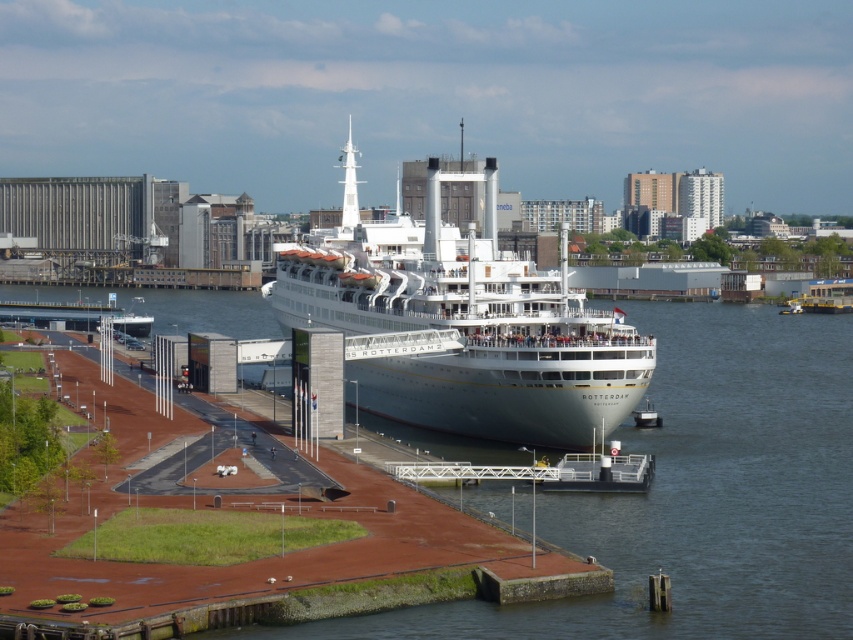
Who is taller, clear water at center or white glossy cruise ship at center?

white glossy cruise ship at center

This screenshot has width=853, height=640. In order to click on clear water at center in this screenshot , I will do `click(700, 496)`.

Is point (828, 337) positioned in front of point (556, 381)?

That is False.

In order to click on clear water at center in this screenshot , I will do `click(700, 496)`.

Looking at this image, who is higher up, white glossy cruise ship at center or white glossy boat at lower left?

white glossy cruise ship at center is higher up.

Between point (483, 364) and point (144, 330), which one is positioned in front?

Point (483, 364)

Identify the location of white glossy cruise ship at center. (463, 323).

The image size is (853, 640). I want to click on white glossy cruise ship at center, so click(x=463, y=323).

Who is lower down, clear water at center or white glossy boat at lower left?

clear water at center is lower down.

From the picture: Who is shorter, clear water at center or white glossy boat at lower left?

With less height is white glossy boat at lower left.

This screenshot has width=853, height=640. What do you see at coordinates (700, 496) in the screenshot?
I see `clear water at center` at bounding box center [700, 496].

At what (x,y) coordinates should I click in order to perform the action: click on clear water at center. Please return your answer as a coordinate pair (x, y). The width and height of the screenshot is (853, 640). Looking at the image, I should click on (700, 496).